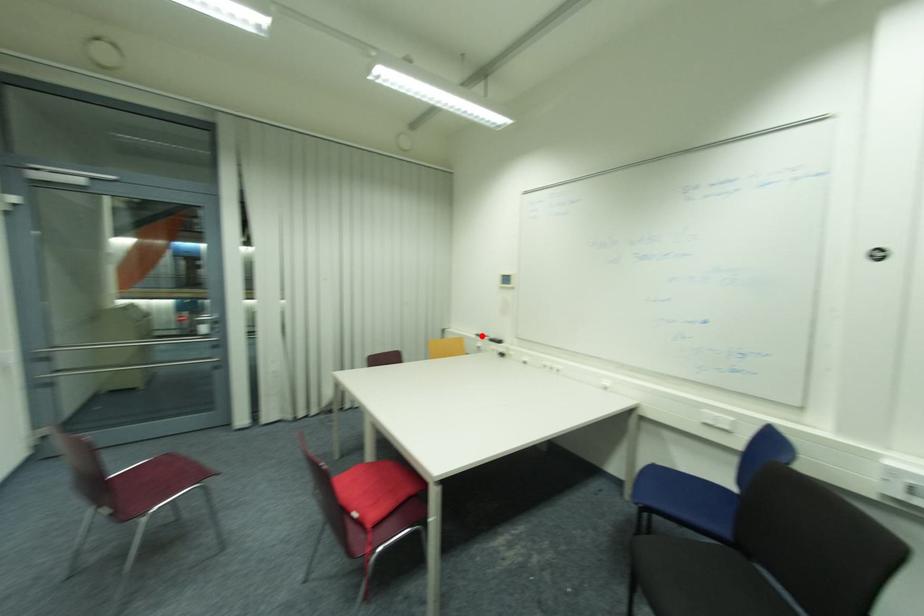
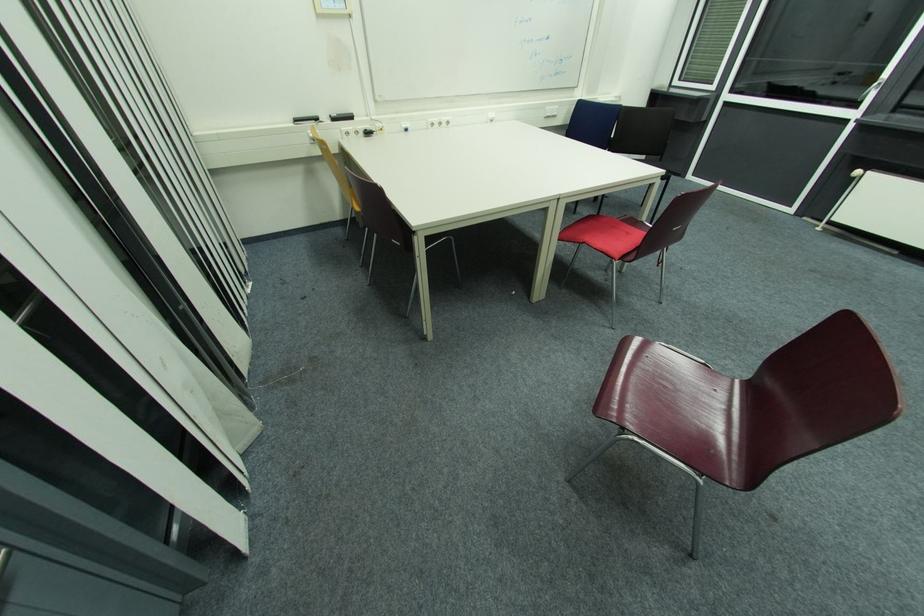
Locate, in the second image, the point that corresponds to the highlighted location in the first image.

(300, 121)